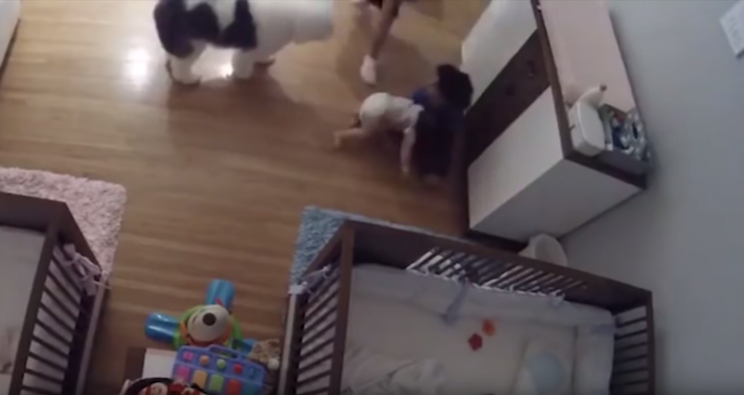
Locate an element on the screen. This screenshot has height=395, width=744. drawers is located at coordinates (533, 86), (516, 98).